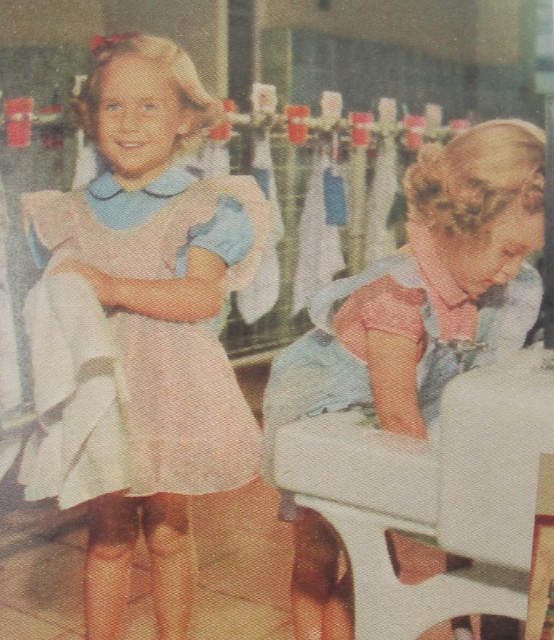
Is pink fabric dress at left above white fabric chair at lower right?

Yes, pink fabric dress at left is above white fabric chair at lower right.

This screenshot has height=640, width=554. Find the location of `pink fabric dress at left`. pink fabric dress at left is located at coordinates (129, 403).

Locate an element on the screen. The height and width of the screenshot is (640, 554). pink fabric dress at left is located at coordinates (129, 403).

Image resolution: width=554 pixels, height=640 pixels. Find the location of `pink fabric dress at left`. pink fabric dress at left is located at coordinates (129, 403).